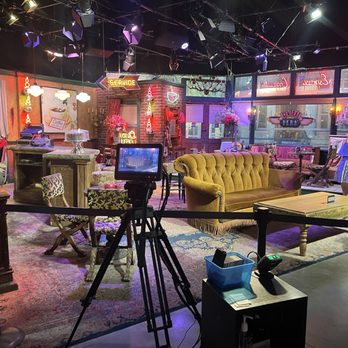
Find the location of `area rug`. area rug is located at coordinates (192, 267), (61, 289).